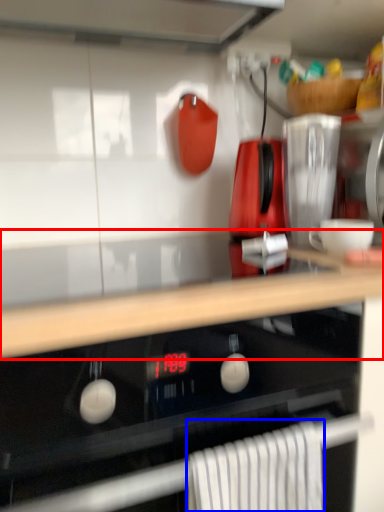
Question: Among these objects, which one is farthest to the camera, countertop (highlighted by a red box) or bath towel (highlighted by a blue box)?

Choices:
 (A) countertop
 (B) bath towel

Answer: (B)